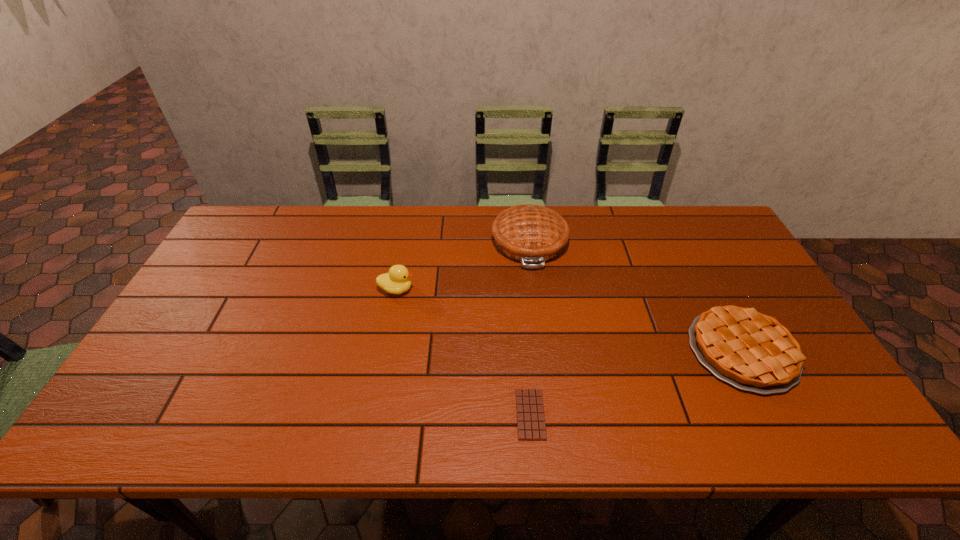
At what (x,y) coordinates should I click in order to perform the action: click on free space between the shorter pie and the duckling. Please return your answer as a coordinate pair (x, y). Image resolution: width=960 pixels, height=540 pixels. Looking at the image, I should click on (569, 320).

Find the location of a particular element. free point between the third shortest object and the rightmost object is located at coordinates (569, 320).

This screenshot has width=960, height=540. Find the location of `vacant area between the rightmost object and the second tallest object`. vacant area between the rightmost object and the second tallest object is located at coordinates (569, 320).

In order to click on free space between the shorter pie and the farther pie in this screenshot , I will do `click(636, 296)`.

Where is `free point between the right pie and the candy bar`? free point between the right pie and the candy bar is located at coordinates (636, 382).

Find the location of `vacant region between the farther pie and the leftmost object`. vacant region between the farther pie and the leftmost object is located at coordinates (463, 266).

The width and height of the screenshot is (960, 540). Identify the location of vacant space that's between the nearer pie and the shortest object. (636, 382).

Locate an element on the screen. This screenshot has height=540, width=960. vacant area that lies between the second shortest object and the farthest object is located at coordinates (636, 296).

Where is `unoccupied position between the left pie and the shortest object`? unoccupied position between the left pie and the shortest object is located at coordinates (530, 328).

Locate which object is the second closest to the third shortest object. Please provide its 2D coordinates. Your answer should be formatted as a tuple, i.e. [(x, y)], where the tuple contains the x and y coordinates of a point satisfying the conditions above.

[(531, 426)]